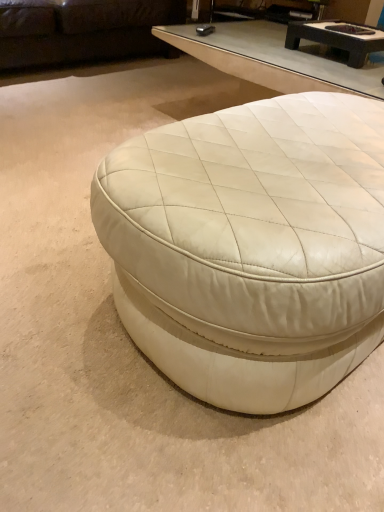
Question: From the image's perspective, is dark brown textured wood coffee table at upper center, acting as the second coffee table starting from the front, located above or below white leather ottoman at center, which is the 2th coffee table in back-to-front order?

Choices:
 (A) below
 (B) above

Answer: (B)

Question: Considering the positions of point (370, 44) and point (299, 103), is point (370, 44) closer or farther from the camera than point (299, 103)?

Choices:
 (A) farther
 (B) closer

Answer: (A)

Question: Which of these objects is positioned closest to the dark brown textured wood coffee table at upper center, the second coffee table in the bottom-to-top sequence?

Choices:
 (A) dark brown leather couch at upper left
 (B) white leather ottoman at center, which is the 2th coffee table in back-to-front order

Answer: (B)

Question: Considering the real-world distances, which object is farthest from the dark brown textured wood coffee table at upper center, acting as the second coffee table starting from the front?

Choices:
 (A) white leather ottoman at center, positioned as the second coffee table in top-to-bottom order
 (B) dark brown leather couch at upper left

Answer: (B)